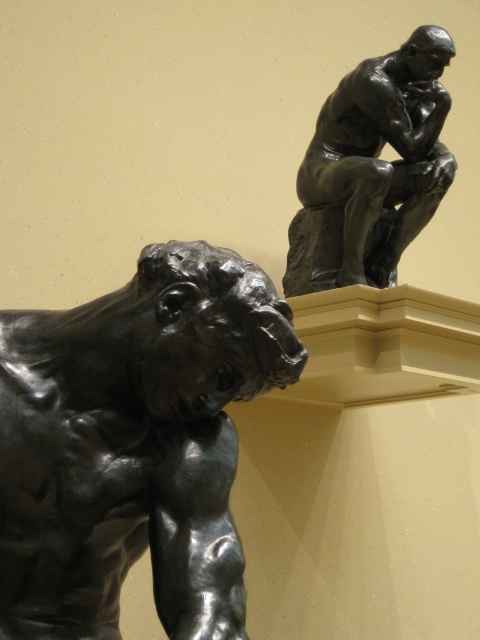
Does polished bronze muscular figure at lower left have a greater width compared to bronze statue at upper right?

No.

Is point (23, 520) positioned behind point (324, 273)?

No, (23, 520) is in front of (324, 273).

At what (x,y) coordinates should I click in order to perform the action: click on polished bronze muscular figure at lower left. Please return your answer as a coordinate pair (x, y). This screenshot has height=640, width=480. Looking at the image, I should click on (133, 444).